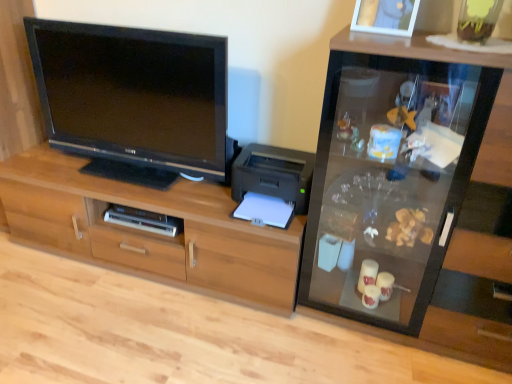
Question: Is transparent glass cabinet at right spatially inside black plastic printer at center, or outside of it?

Choices:
 (A) outside
 (B) inside

Answer: (A)

Question: From their relative heights in the image, would you say transparent glass cabinet at right is taller or shorter than black plastic printer at center?

Choices:
 (A) short
 (B) tall

Answer: (B)

Question: Which object is the closest to the transparent glass cabinet at right?

Choices:
 (A) black glossy tv at left
 (B) wooden picture frame at upper right
 (C) wooden cabinet at center
 (D) black plastic printer at center
 (E) silver metallic dvd player at lower center

Answer: (D)

Question: Which object is the farthest from the silver metallic dvd player at lower center?

Choices:
 (A) black plastic printer at center
 (B) wooden picture frame at upper right
 (C) transparent glass cabinet at right
 (D) black glossy tv at left
 (E) wooden cabinet at center

Answer: (B)